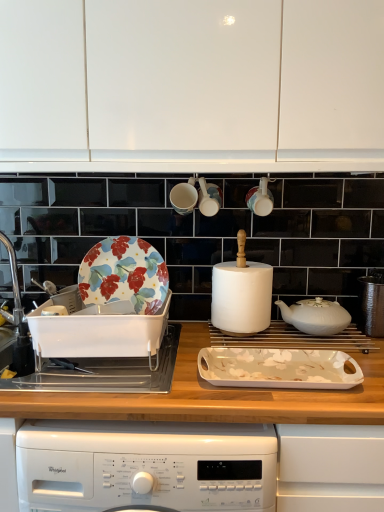
Question: From a real-world perspective, does white matte cabinet at upper center sit lower than silver metallic sink at left, which is the second sink in right-to-left order?

Choices:
 (A) yes
 (B) no

Answer: (B)

Question: Does white matte cabinet at upper center lie behind silver metallic sink at left, which is the second sink in right-to-left order?

Choices:
 (A) no
 (B) yes

Answer: (A)

Question: Could you tell me if white matte cabinet at upper center is turned towards silver metallic sink at left, which is counted as the 1th sink, starting from the left?

Choices:
 (A) no
 (B) yes

Answer: (A)

Question: Is white matte cabinet at upper center not close to silver metallic sink at left, which is counted as the 1th sink, starting from the left?

Choices:
 (A) yes
 (B) no

Answer: (B)

Question: Can you confirm if white matte cabinet at upper center is taller than silver metallic sink at left, which is the second sink in right-to-left order?

Choices:
 (A) yes
 (B) no

Answer: (A)

Question: In the image, is white glossy mugs at upper center, which is the second appliance from left to right, on the left side or the right side of wooden at center?

Choices:
 (A) left
 (B) right

Answer: (B)

Question: Is white glossy mugs at upper center, which is the second appliance from left to right, inside the boundaries of wooden at center, or outside?

Choices:
 (A) outside
 (B) inside

Answer: (A)

Question: Considering the positions of white glossy mugs at upper center, which is the 2th appliance in right-to-left order, and wooden at center in the image, is white glossy mugs at upper center, which is the 2th appliance in right-to-left order, taller or shorter than wooden at center?

Choices:
 (A) tall
 (B) short

Answer: (B)

Question: From the image's perspective, is white glossy mugs at upper center, which is the second appliance from left to right, above or below wooden at center?

Choices:
 (A) above
 (B) below

Answer: (A)

Question: From the image's perspective, is floral-patterned ceramic plate at left located above or below silver metallic sink at left, which is the second sink in right-to-left order?

Choices:
 (A) below
 (B) above

Answer: (B)

Question: Is floral-patterned ceramic plate at left in front of or behind silver metallic sink at left, which is counted as the 1th sink, starting from the left, in the image?

Choices:
 (A) front
 (B) behind

Answer: (A)

Question: Considering the positions of point (152, 284) and point (18, 360), is point (152, 284) closer or farther from the camera than point (18, 360)?

Choices:
 (A) closer
 (B) farther

Answer: (B)

Question: From a real-world perspective, is floral-patterned ceramic plate at left physically located above or below silver metallic sink at left, which is counted as the 1th sink, starting from the left?

Choices:
 (A) above
 (B) below

Answer: (A)

Question: Is white ceramic teapot at center, the 2th kitchen appliance in the bottom-to-top sequence, bigger or smaller than silver metallic sink at left, which is the second sink in right-to-left order?

Choices:
 (A) big
 (B) small

Answer: (B)

Question: Would you say white ceramic teapot at center, positioned as the second kitchen appliance in front-to-back order, is inside or outside silver metallic sink at left, which is the second sink in right-to-left order?

Choices:
 (A) inside
 (B) outside

Answer: (B)